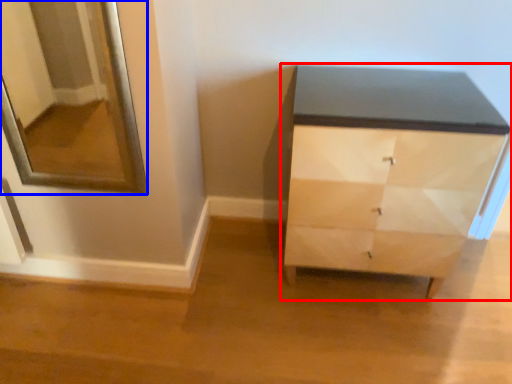
Question: Which of the following is the farthest to the observer, chest of drawers (highlighted by a red box) or mirror (highlighted by a blue box)?

Choices:
 (A) chest of drawers
 (B) mirror

Answer: (A)